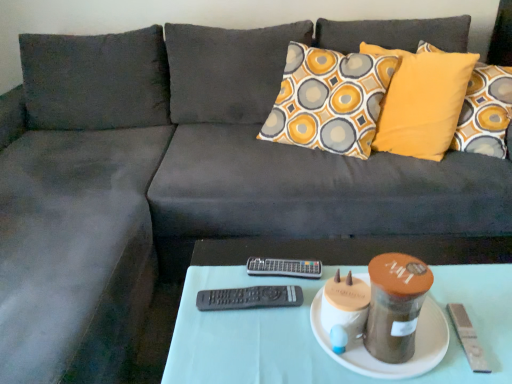
This screenshot has width=512, height=384. In order to click on free spot above white fabric table at center (from a real-world perspective) in this screenshot , I will do `click(345, 345)`.